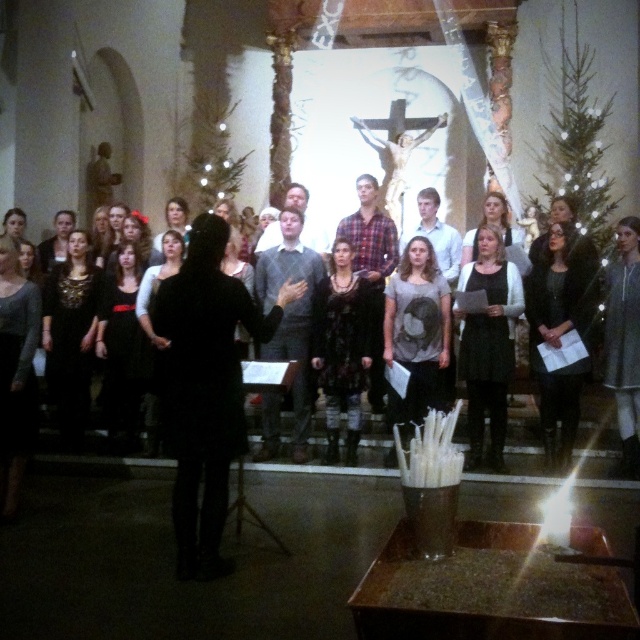
Between black dress at center and dark gray sweater at right, which one is positioned higher?

dark gray sweater at right is above.

Which is in front, point (468, 385) or point (627, 380)?

Positioned in front is point (627, 380).

Where is `black dress at center`? The height and width of the screenshot is (640, 640). black dress at center is located at coordinates (488, 344).

Which is more to the right, black matte dress at center or black dress at center?

black dress at center is more to the right.

Who is more forward, (177, 484) or (509, 378)?

Positioned in front is point (177, 484).

Who is more distant from viewer, (204,465) or (486,280)?

Positioned behind is point (486,280).

The width and height of the screenshot is (640, 640). Find the location of `black matte dress at center`. black matte dress at center is located at coordinates (205, 387).

Which is more to the right, dark textured dress at center or dark gray sweater at right?

Positioned to the right is dark gray sweater at right.

Who is more forward, (349, 412) or (618, 268)?

Point (349, 412)

Where is `dark textured dress at center`? The width and height of the screenshot is (640, 640). dark textured dress at center is located at coordinates (342, 348).

At what (x,y) coordinates should I click in order to perform the action: click on dark textured dress at center. Please return your answer as a coordinate pair (x, y). Looking at the image, I should click on (342, 348).